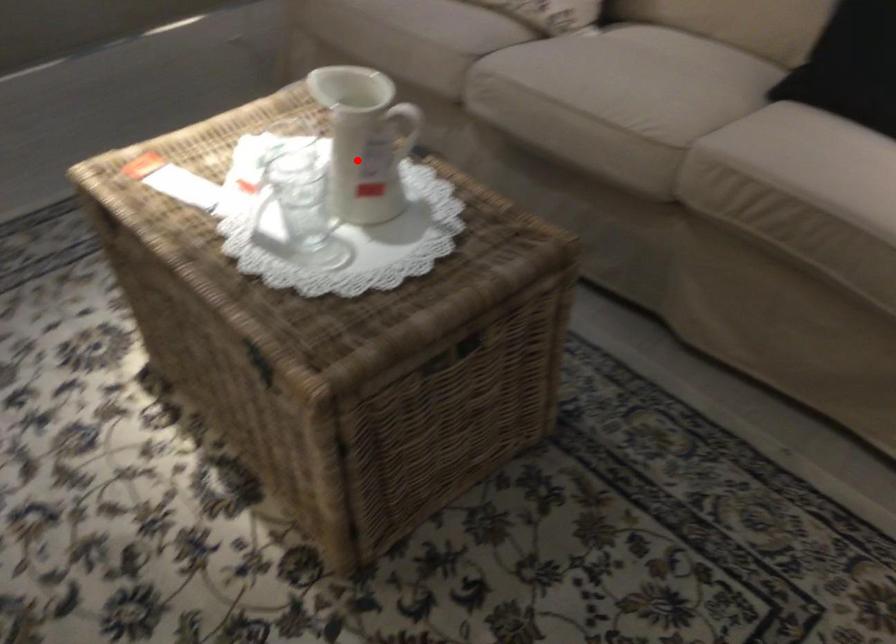
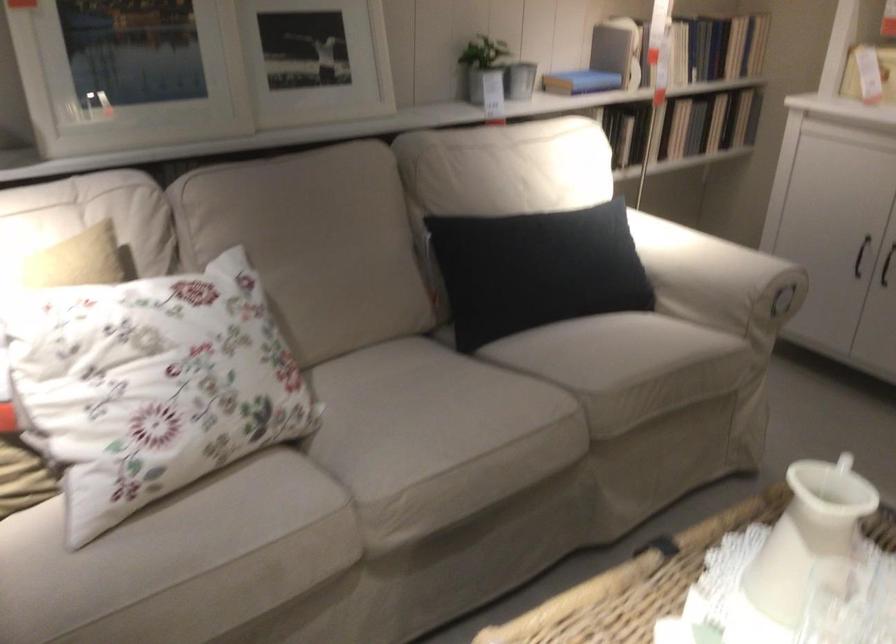
Locate, in the second image, the point that corresponds to the highlighted location in the first image.

(803, 552)